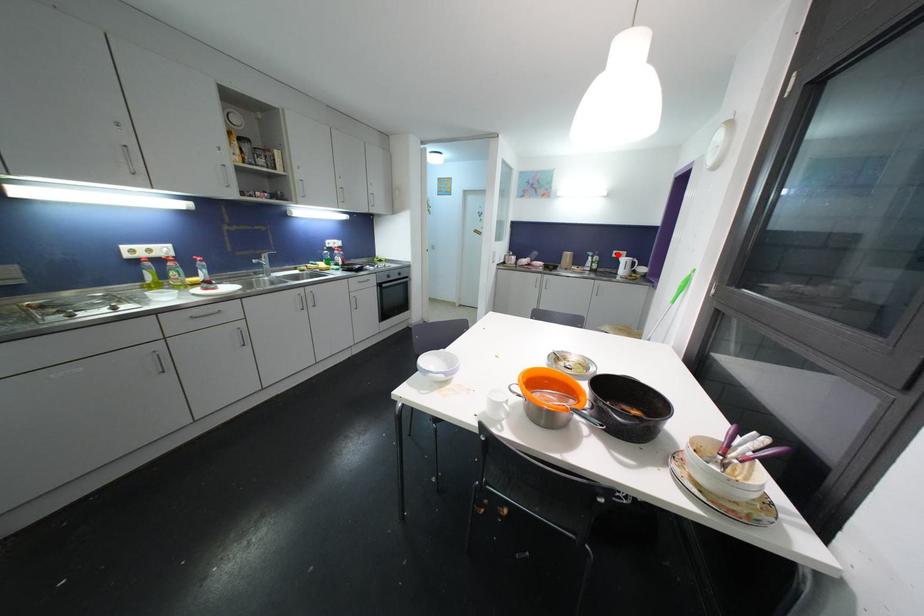
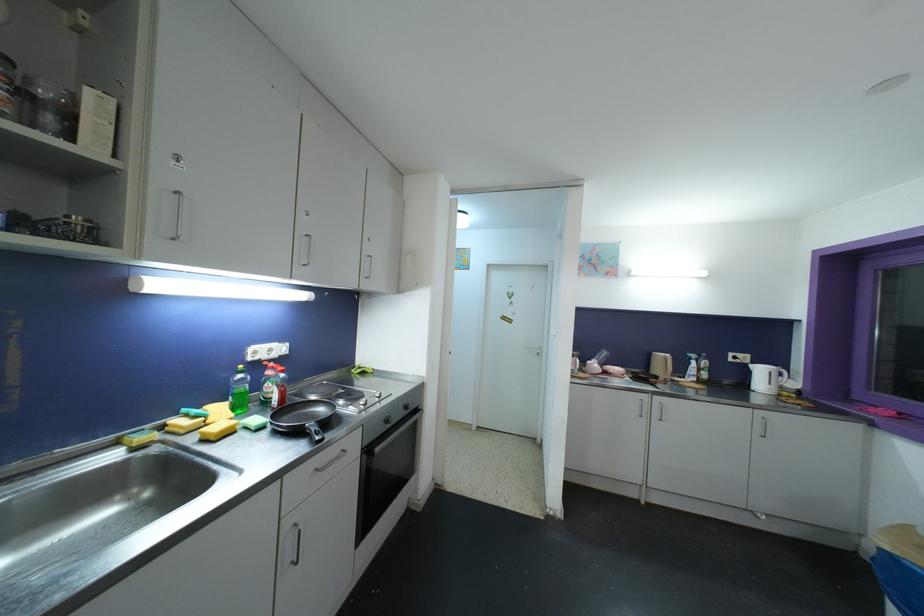
Question: I am providing you with two images of the same scene from different viewpoints. Given a red point in image1, look at the same physical point in image2. Is it:

Choices:
 (A) Closer to the viewpoint
 (B) Farther from the viewpoint

Answer: (B)